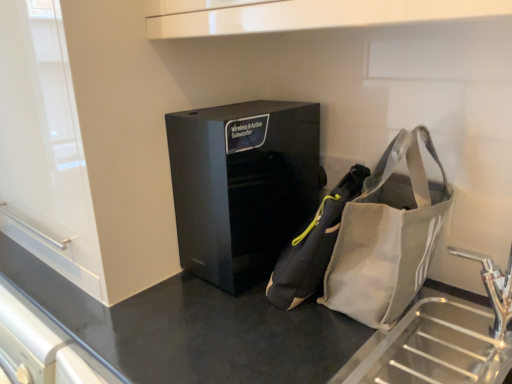
In order to click on gray fabric pouch at center in this screenshot , I will do `click(313, 246)`.

Image resolution: width=512 pixels, height=384 pixels. Identify the location of black glossy speaker at center. (242, 186).

Where is `gray fabric bag at lower right`? The height and width of the screenshot is (384, 512). gray fabric bag at lower right is located at coordinates (387, 236).

Based on the photo, is black glossy speaker at center positioned far away from black matte counter at center?

No, there isn't a large distance between black glossy speaker at center and black matte counter at center.

Is point (205, 208) closer or farther from the camera than point (174, 323)?

Clearly, point (205, 208) is more distant from the camera than point (174, 323).

From the image's perspective, is black glossy speaker at center below black matte counter at center?

No, from the image's perspective, black glossy speaker at center is not beneath black matte counter at center.

From a real-world perspective, which is physically below, black glossy speaker at center or black matte counter at center?

In real-world perspective, black matte counter at center is lower.

Which is behind, point (226, 217) or point (340, 184)?

Positioned behind is point (340, 184).

From a real-world perspective, which is physically above, black glossy speaker at center or gray fabric pouch at center?

black glossy speaker at center, from a real-world perspective.

Does black glossy speaker at center lie behind gray fabric pouch at center?

Yes, black glossy speaker at center is further from the camera.

Which of these two, gray fabric bag at lower right or black matte counter at center, stands taller?

With more height is black matte counter at center.

Looking at this image, is gray fabric bag at lower right behind black matte counter at center?

Yes, the depth of gray fabric bag at lower right is greater than that of black matte counter at center.

Does point (420, 260) lie in front of point (73, 311)?

That is True.

Considering the relative sizes of gray fabric bag at lower right and black matte counter at center in the image provided, is gray fabric bag at lower right thinner than black matte counter at center?

Correct, the width of gray fabric bag at lower right is less than that of black matte counter at center.

How many degrees apart are the facing directions of black matte counter at center and gray fabric pouch at center?

They differ by 69.5 degrees in their facing directions.

Does point (77, 306) lie in front of point (332, 197)?

No, (77, 306) is behind (332, 197).

Is black matte counter at center bigger than gray fabric pouch at center?

Correct, black matte counter at center is larger in size than gray fabric pouch at center.

Is black matte counter at center not near gray fabric pouch at center?

That's not correct — black matte counter at center is a little close to gray fabric pouch at center.

Between black matte counter at center and black glossy speaker at center, which one has more height?

With more height is black matte counter at center.

Between black matte counter at center and black glossy speaker at center, which one has smaller size?

Smaller between the two is black glossy speaker at center.

Which is more to the right, black matte counter at center or black glossy speaker at center?

black matte counter at center.

Considering the sizes of objects gray fabric pouch at center and black glossy speaker at center in the image provided, who is thinner, gray fabric pouch at center or black glossy speaker at center?

With smaller width is gray fabric pouch at center.

Based on their positions, is gray fabric pouch at center located to the left or right of black glossy speaker at center?

From the image, it's evident that gray fabric pouch at center is to the right of black glossy speaker at center.

Where is `furniture above the gray fabric pouch at center (from the image's perspective)`? furniture above the gray fabric pouch at center (from the image's perspective) is located at coordinates (242, 186).

Where is `handbag above the gray fabric pouch at center (from the image's perspective)`? handbag above the gray fabric pouch at center (from the image's perspective) is located at coordinates (387, 236).

Measure the distance between gray fabric bag at lower right and gray fabric pouch at center.

They are 3.24 inches apart.

From a real-world perspective, is gray fabric bag at lower right above or below gray fabric pouch at center?

gray fabric bag at lower right is situated higher than gray fabric pouch at center in the real world.

Between gray fabric bag at lower right and gray fabric pouch at center, which one has larger width?

gray fabric bag at lower right is wider.

Locate an element on the screen. The width and height of the screenshot is (512, 384). counter below the black glossy speaker at center (from the image's perspective) is located at coordinates (258, 335).

The image size is (512, 384). What are the coordinates of `pouch on the right of black glossy speaker at center` in the screenshot? It's located at point(313,246).

Estimate the real-world distances between objects in this image. Which object is closer to gray fabric pouch at center, black glossy speaker at center or gray fabric bag at lower right?

The object closer to gray fabric pouch at center is gray fabric bag at lower right.

From the image, which object appears to be farther from black glossy speaker at center, gray fabric bag at lower right or gray fabric pouch at center?

gray fabric bag at lower right is positioned further to the anchor black glossy speaker at center.

Based on the photo, considering their positions, is black matte counter at center positioned further to gray fabric bag at lower right than gray fabric pouch at center?

black matte counter at center is positioned further to the anchor gray fabric bag at lower right.

Based on their spatial positions, is black matte counter at center or black glossy speaker at center closer to gray fabric pouch at center?

black glossy speaker at center is positioned closer to the anchor gray fabric pouch at center.

Based on their spatial positions, is black matte counter at center or gray fabric bag at lower right closer to gray fabric pouch at center?

Among the two, gray fabric bag at lower right is located nearer to gray fabric pouch at center.

In the scene shown: Which object lies nearer to the anchor point gray fabric pouch at center, gray fabric bag at lower right or black matte counter at center?

Based on the image, gray fabric bag at lower right appears to be nearer to gray fabric pouch at center.

Looking at the image, which one is located closer to gray fabric bag at lower right, black matte counter at center or black glossy speaker at center?

black matte counter at center lies closer to gray fabric bag at lower right than the other object.

Based on their spatial positions, is gray fabric pouch at center or black glossy speaker at center further from gray fabric bag at lower right?

black glossy speaker at center is further to gray fabric bag at lower right.

Locate an element on the screen. This screenshot has width=512, height=384. handbag between black glossy speaker at center and black matte counter at center from top to bottom is located at coordinates (387, 236).

Identify the location of pouch situated between black glossy speaker at center and gray fabric bag at lower right from left to right. This screenshot has height=384, width=512. (313, 246).

This screenshot has height=384, width=512. Find the location of `pouch that lies between black glossy speaker at center and black matte counter at center from top to bottom`. pouch that lies between black glossy speaker at center and black matte counter at center from top to bottom is located at coordinates (313, 246).

This screenshot has height=384, width=512. Find the location of `pouch between gray fabric bag at lower right and black matte counter at center in the vertical direction`. pouch between gray fabric bag at lower right and black matte counter at center in the vertical direction is located at coordinates pos(313,246).